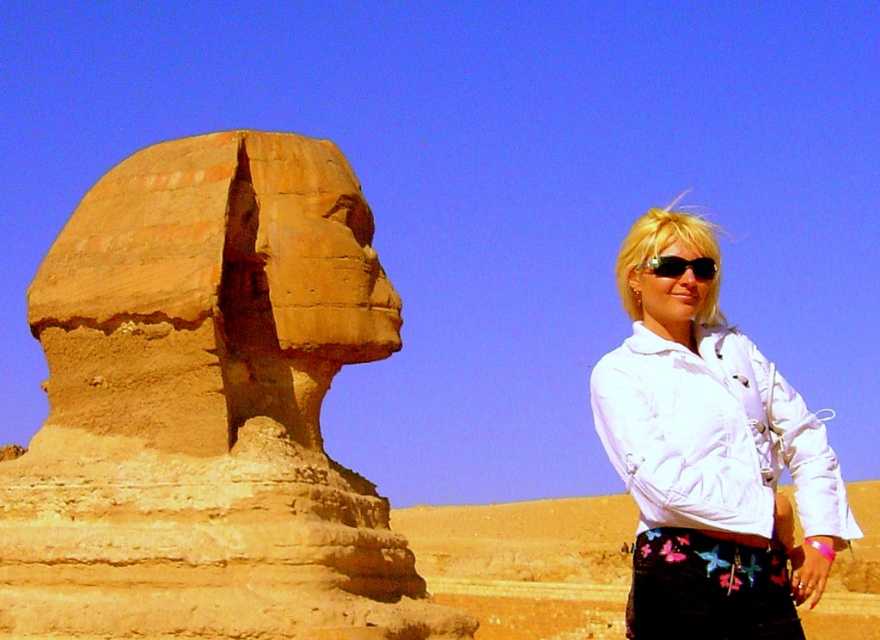
Question: Can you confirm if white matte jacket at right is wider than black plastic sunglasses at upper right?

Choices:
 (A) yes
 (B) no

Answer: (A)

Question: Estimate the real-world distances between objects in this image. Which object is farther from the black plastic sunglasses at upper right?

Choices:
 (A) white fabric jacket at right
 (B) sandstone statue at left

Answer: (B)

Question: Which object appears closest to the camera in this image?

Choices:
 (A) sandstone statue at left
 (B) white fabric jacket at right

Answer: (B)

Question: Which is farther from the white matte jacket at right?

Choices:
 (A) white fabric jacket at right
 (B) sandstone statue at left

Answer: (B)

Question: Is sandstone statue at left bigger than white fabric jacket at right?

Choices:
 (A) yes
 (B) no

Answer: (B)

Question: Can you confirm if sandstone statue at left is positioned above white matte jacket at right?

Choices:
 (A) yes
 (B) no

Answer: (A)